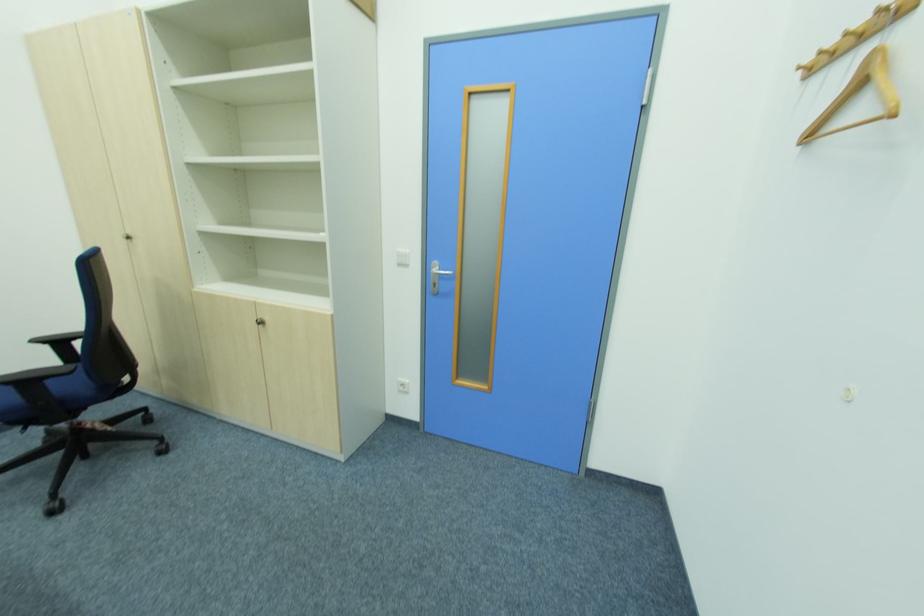
What do you see at coordinates (74, 430) in the screenshot? I see `the chair sitting surface` at bounding box center [74, 430].